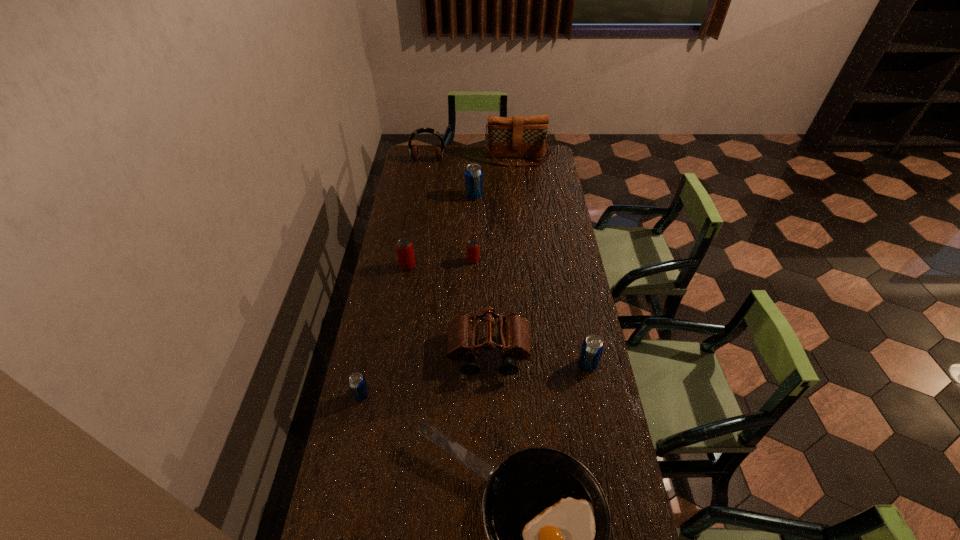
What are the coordinates of `the smallest blue beer can` in the screenshot? It's located at 357,382.

The height and width of the screenshot is (540, 960). I want to click on the right pink beer can, so click(x=472, y=246).

This screenshot has height=540, width=960. What are the coordinates of `free space located on the front-facing side of the shoulder bag` in the screenshot? It's located at 520,182.

At what (x,y) coordinates should I click in order to perform the action: click on free region located on the ear cup of the brown headset. Please return your answer as a coordinate pair (x, y). Looking at the image, I should click on (420, 209).

The height and width of the screenshot is (540, 960). What are the coordinates of `vacant area situated 0.300m on the front of the tallest beer can` in the screenshot? It's located at (473, 242).

Where is `free location located 0.180m through the eyepieces of the binoculars`? The image size is (960, 540). free location located 0.180m through the eyepieces of the binoculars is located at coordinates (490, 431).

Where is `vacant space located 0.380m on the front of the rightmost blue beer can`? This screenshot has width=960, height=540. vacant space located 0.380m on the front of the rightmost blue beer can is located at coordinates (612, 493).

Find the location of a particular element. The width and height of the screenshot is (960, 540). free region located 0.260m on the right of the fourth beer can from right to left is located at coordinates (478, 266).

Find the location of a particular element. The image size is (960, 540). free space located on the right of the nearest blue beer can is located at coordinates (441, 395).

At what (x,y) coordinates should I click in order to perform the action: click on free space located 0.160m on the left of the smaller pink beer can. Please return your answer as a coordinate pair (x, y). This screenshot has height=540, width=960. Looking at the image, I should click on click(x=429, y=261).